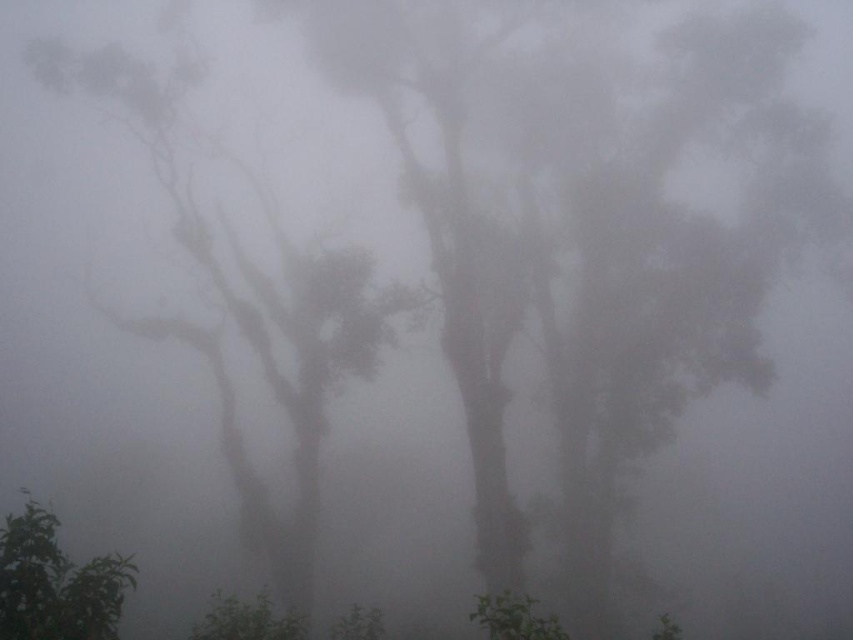
Is point (312, 496) behind point (97, 572)?

Yes.

Is foggy translucent tree at left taller than green leafy tree at lower left?

Indeed, foggy translucent tree at left has a greater height compared to green leafy tree at lower left.

Where is `foggy translucent tree at left`? The image size is (853, 640). foggy translucent tree at left is located at coordinates (251, 308).